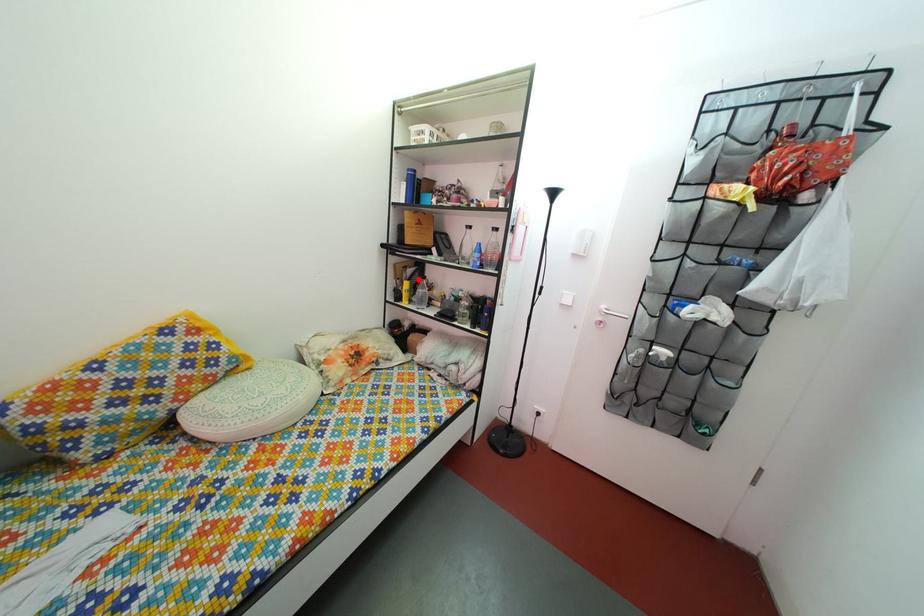
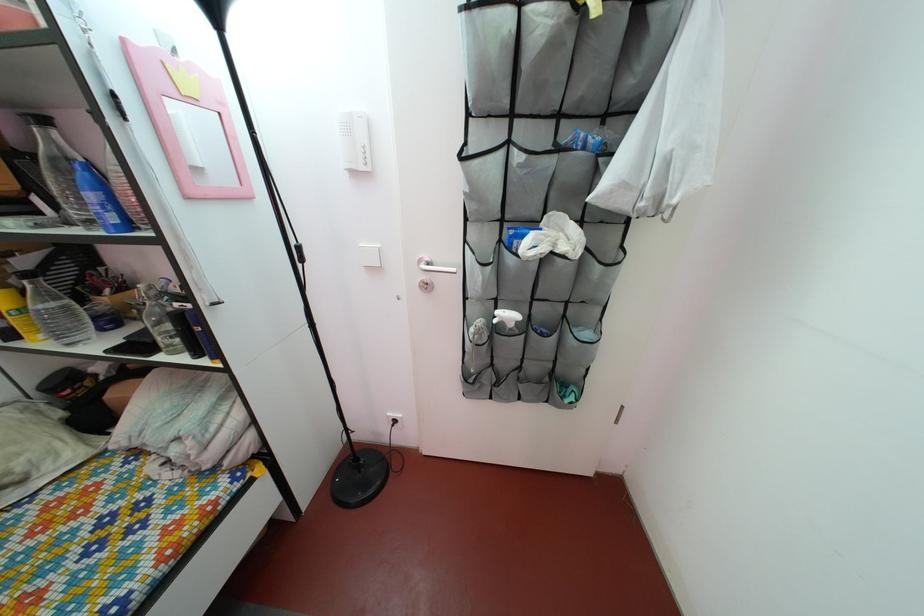
Locate, in the second image, the point that corresponds to the highlighted location in the first image.

(32, 270)